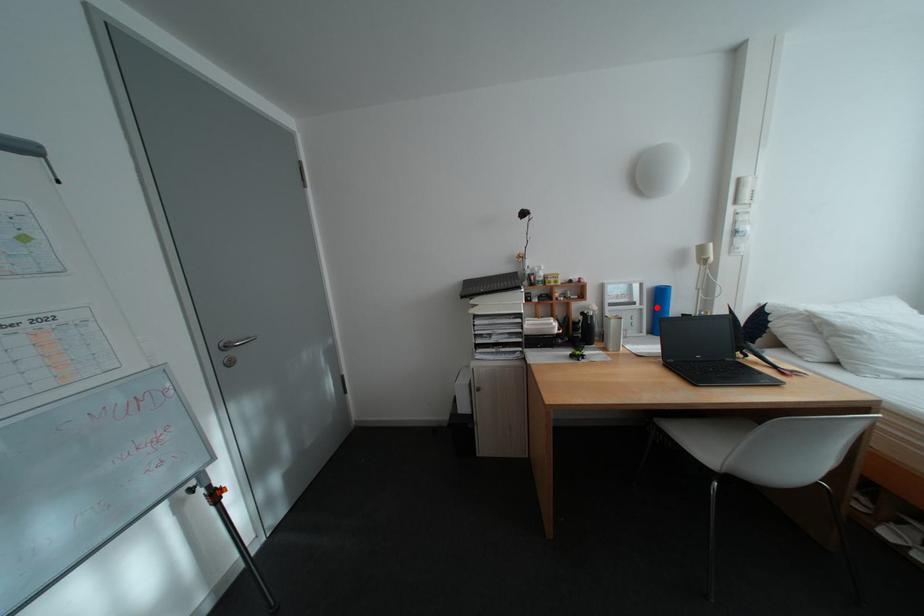
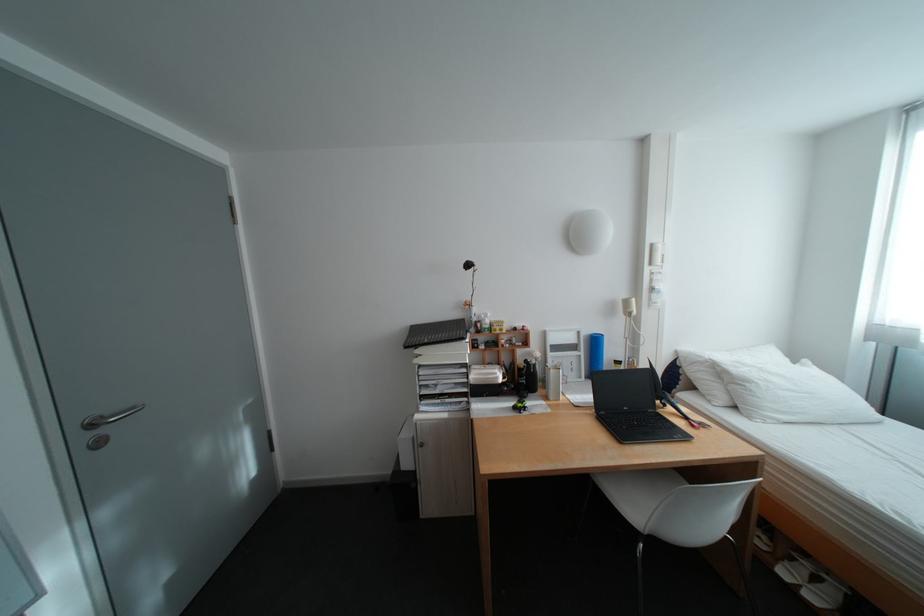
Locate, in the second image, the point that corresponds to the highlighted location in the first image.

(594, 354)